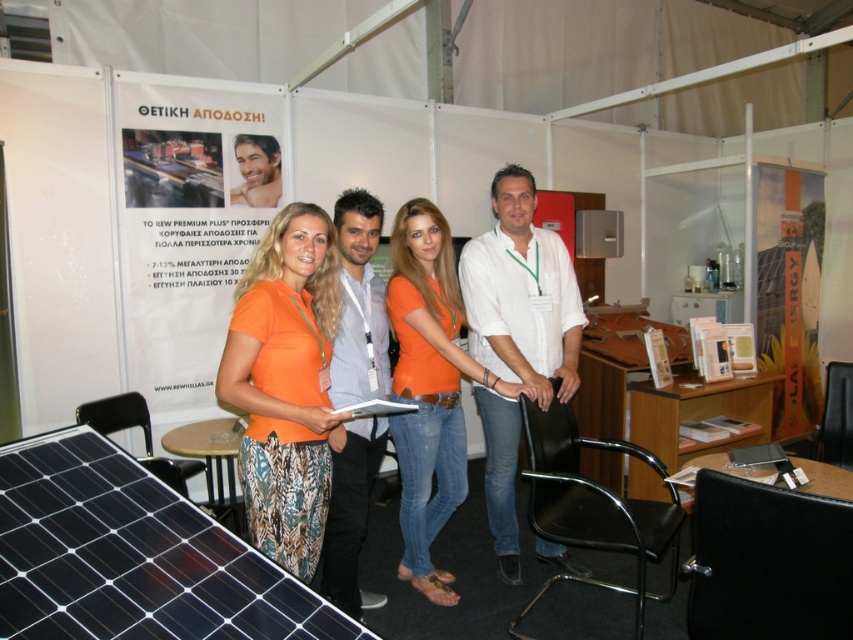
Question: Which of the following is the farthest from the observer?

Choices:
 (A) orange cotton t-shirt at center
 (B) white plastic clipboard at center
 (C) orange fabric skirt at center

Answer: (A)

Question: Which point is farther to the camera?

Choices:
 (A) white plastic clipboard at center
 (B) orange cotton t-shirt at center

Answer: (B)

Question: Is orange cotton t-shirt at center to the right of white plastic clipboard at center from the viewer's perspective?

Choices:
 (A) yes
 (B) no

Answer: (A)

Question: Is orange fabric skirt at center above orange cotton t-shirt at center?

Choices:
 (A) yes
 (B) no

Answer: (A)

Question: Is orange cotton t-shirt at center bigger than white plastic clipboard at center?

Choices:
 (A) yes
 (B) no

Answer: (A)

Question: Which point is closer to the camera?

Choices:
 (A) orange fabric skirt at center
 (B) white plastic clipboard at center
 (C) orange cotton t-shirt at center

Answer: (A)